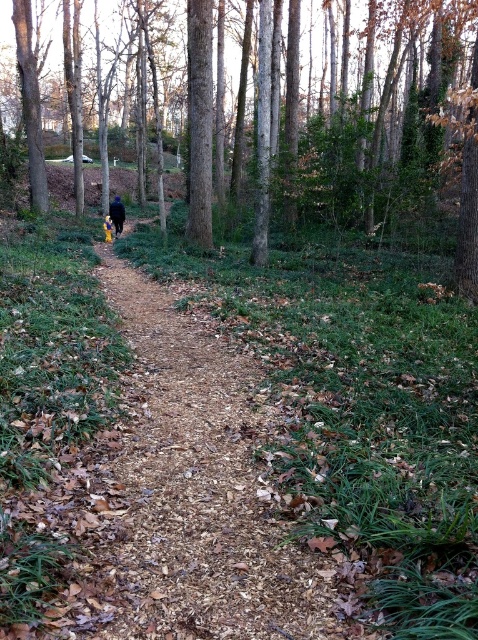
You are a hiker walking along the dirt path in the forest. You notice the brown smooth tree at center and the yellow fabric at center. Which object is closer to you?

The brown smooth tree at center is closer to you because it is in front of the yellow fabric at center.

You are a hiker walking along the narrow dirt path in the forest. You notice a brown smooth tree at center and a yellow fabric at center. Which object is taller?

The brown smooth tree at center is taller than the yellow fabric at center.